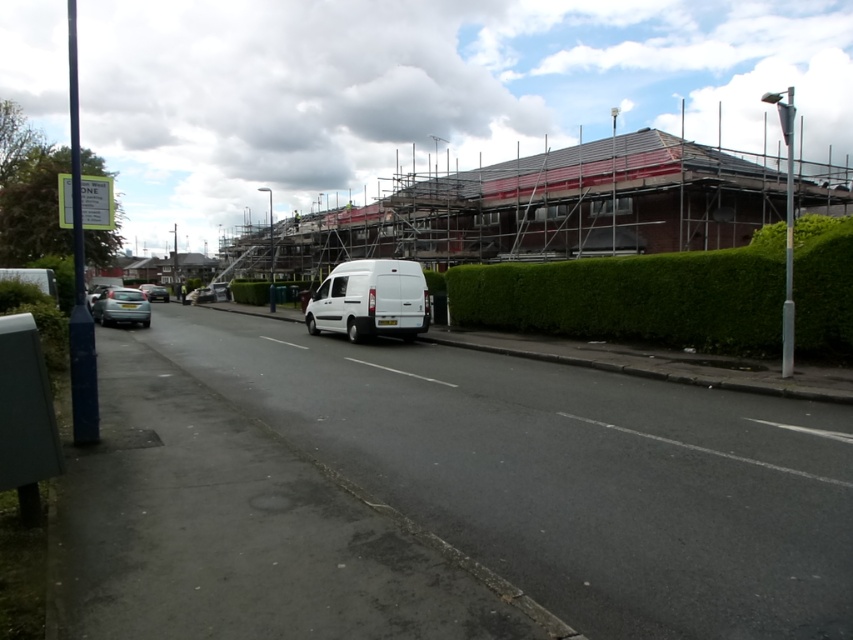
You are a delivery driver who needs to park your metallic silver car at lower left near the green leafy hedge at center. The parking spot is exactly between them. Is there enough space for your car, which is 4.5 meters long, to fit in the parking spot?

The distance between the green leafy hedge at center and the metallic silver car at lower left is 17.76 meters. Since the parking spot is exactly between them, the available space is 17.76 meters divided by 2 equals 8.88 meters. The metallic silver car at lower left is 4.5 meters long, so it can fit comfortably within the 8.88 meters of space available.

You are a pedestrian standing on the sidewalk near the blue pole. You want to cross the road to reach the construction site. Which car, the metallic silver car at lower left or the silver metallic car at center, is closer to you?

The metallic silver car at lower left is closer to you because it is in front of the silver metallic car at center.